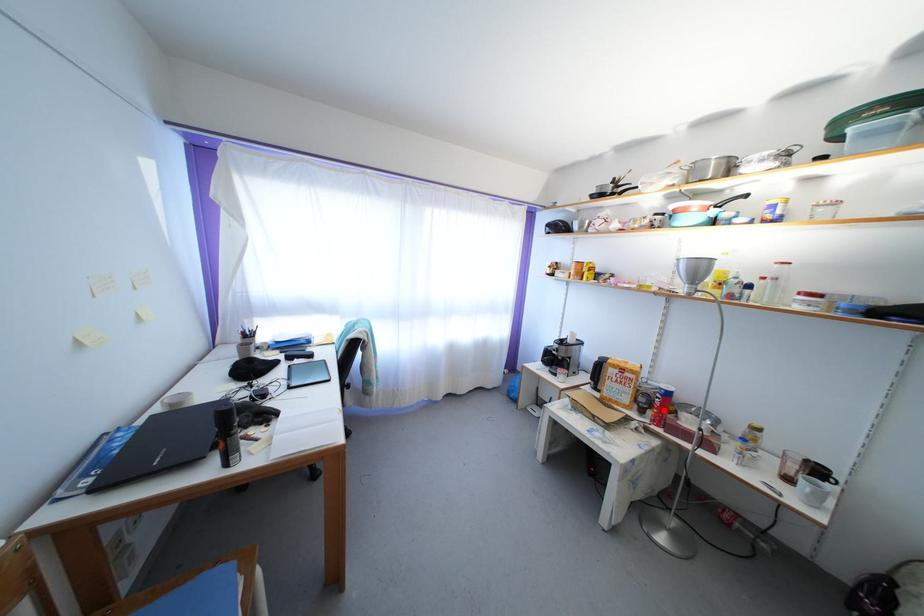
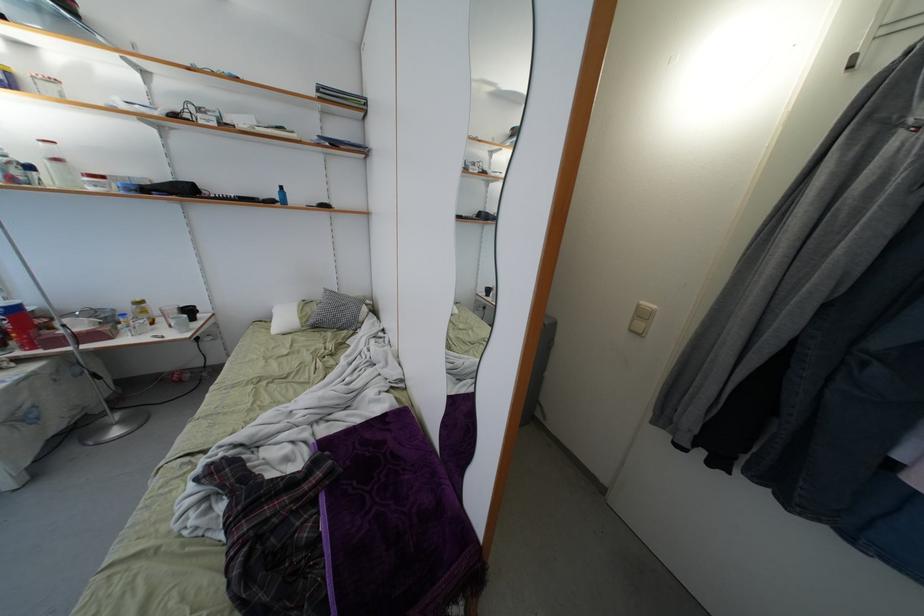
Where in the second image is the point corresponding to the highlighted location from the first image?

(22, 333)